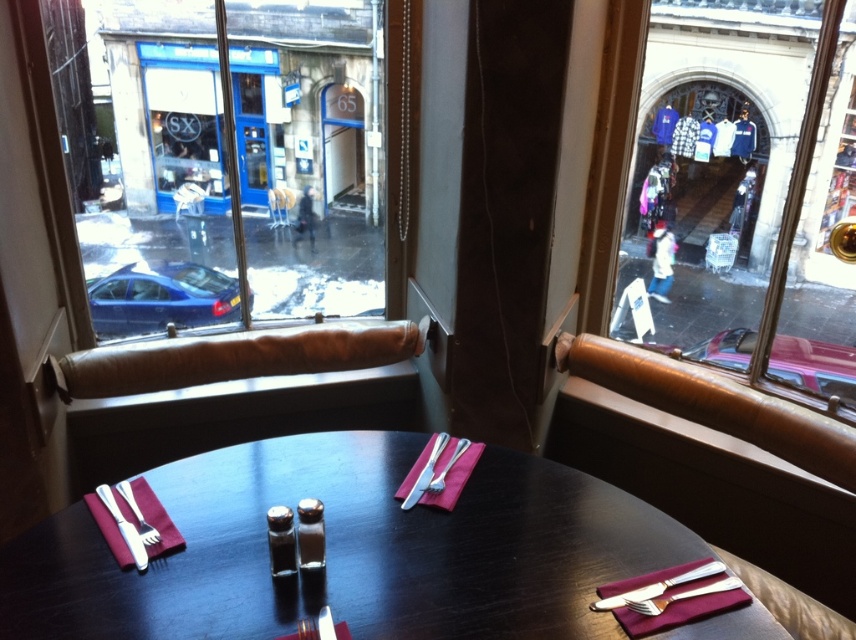
You are a customer sitting at the shiny dark wood table at center and looking towards the glass window at upper right. Which side of the table is closer to the window?

The left side of the shiny dark wood table at center is closer to the glass window at upper right because the table is positioned on the left side of the window.

Looking at this image, where is the shiny dark wood table at center located in the image?

The shiny dark wood table at center is located at point coordinates of [348,550].